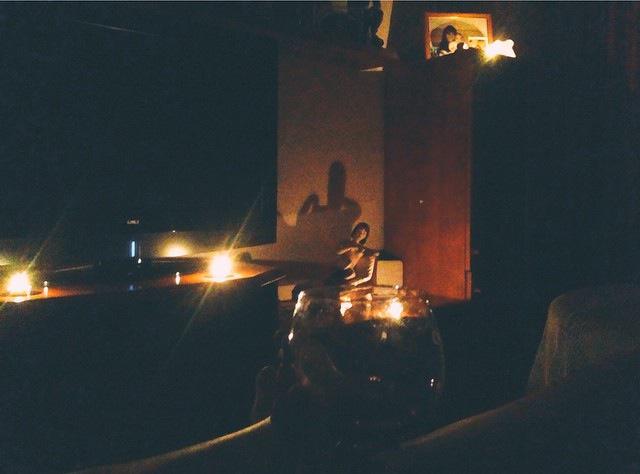
Where is `wooden shelf mounted on wall`? Image resolution: width=640 pixels, height=474 pixels. wooden shelf mounted on wall is located at coordinates (376, 54).